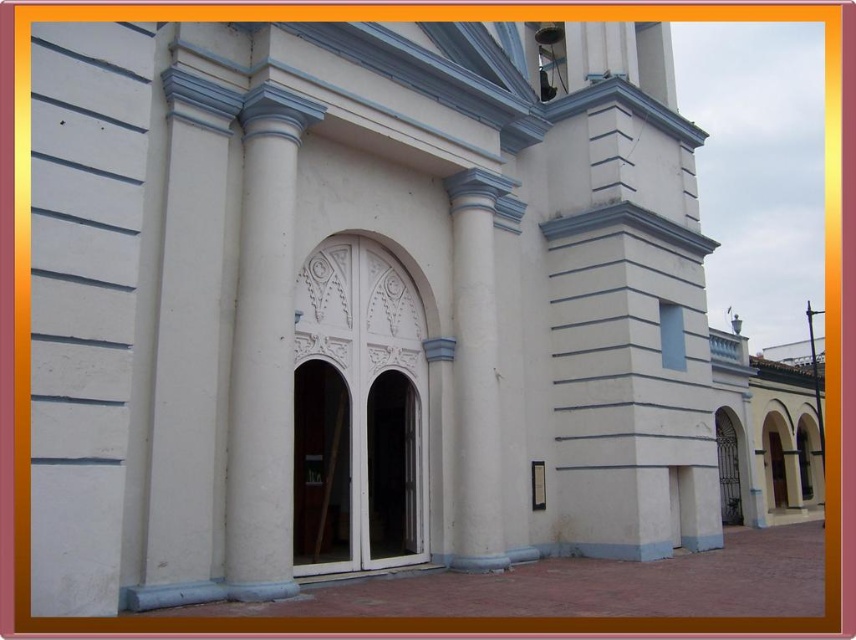
Question: Which object is farther from the camera taking this photo?

Choices:
 (A) white smooth column at center
 (B) white glossy column at center

Answer: (A)

Question: Can you confirm if white glossy column at center is thinner than white smooth column at center?

Choices:
 (A) no
 (B) yes

Answer: (B)

Question: Is white glossy column at center to the left of white smooth column at center from the viewer's perspective?

Choices:
 (A) no
 (B) yes

Answer: (B)

Question: Which of the following is the farthest from the observer?

Choices:
 (A) (482, 452)
 (B) (288, 232)

Answer: (A)

Question: Is white glossy column at center further to the viewer compared to white smooth column at center?

Choices:
 (A) no
 (B) yes

Answer: (A)

Question: Among these objects, which one is nearest to the camera?

Choices:
 (A) white smooth column at center
 (B) white glossy column at center

Answer: (B)